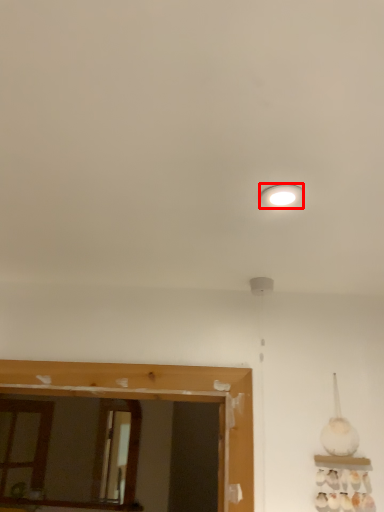
Question: Considering the relative positions of lighting (annotated by the red box) and mirror in the image provided, where is lighting (annotated by the red box) located with respect to the staircase?

Choices:
 (A) left
 (B) right

Answer: (B)